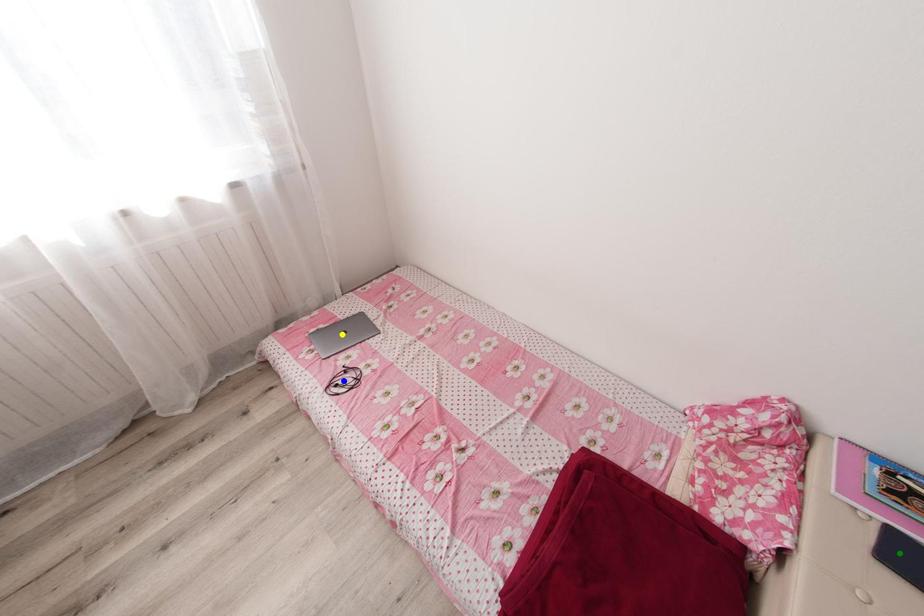
In the scene shown: Order these from nearest to farthest:
yellow point
blue point
green point

yellow point < blue point < green point